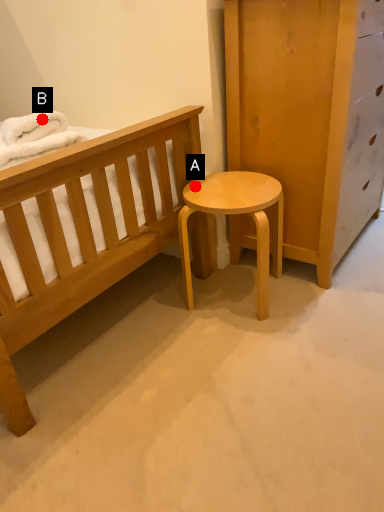
Question: Two points are circled on the image, labeled by A and B beside each circle. Which point appears farthest from the camera in this image?

Choices:
 (A) A is further
 (B) B is further

Answer: (A)